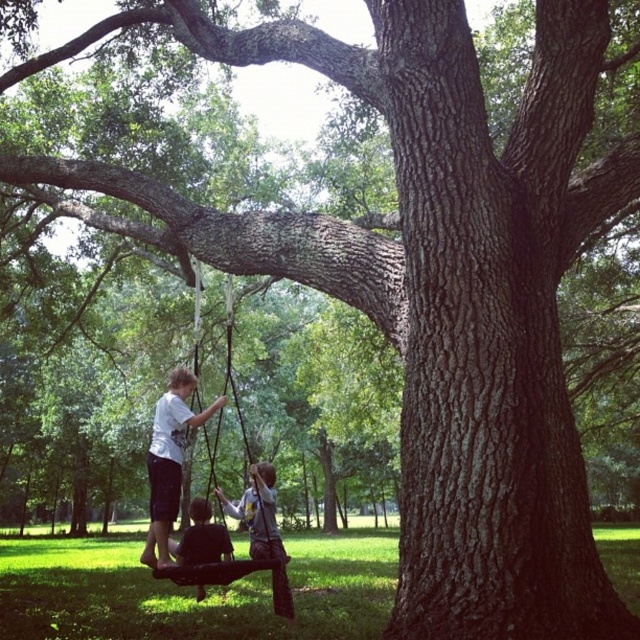
You are a photographer trying to capture a photo of the white cotton shirt at center and the dark brown leather swing at lower center. You want to ensure both are in the frame. Based on their positions, which object should you focus on first to include both in your shot?

The white cotton shirt at center is positioned on the left side of dark brown leather swing at lower center, so focusing on the dark brown leather swing at lower center first would ensure both are included in the frame as the swing is the central point between them.

You are a photographer trying to capture a clear photo of both the white cotton shirt at center and the dark brown leather swing at lower center. Based on their positions, which object will appear larger in the photo?

The white cotton shirt at center will appear larger in the photo because it is closer to the viewer than the dark brown leather swing at lower center.

You are a parent watching your children play in the park. You notice the white cotton shirt at center and the dark brown leather swing at lower center. How far apart are these two items?

The white cotton shirt at center and the dark brown leather swing at lower center are 26.96 inches apart.